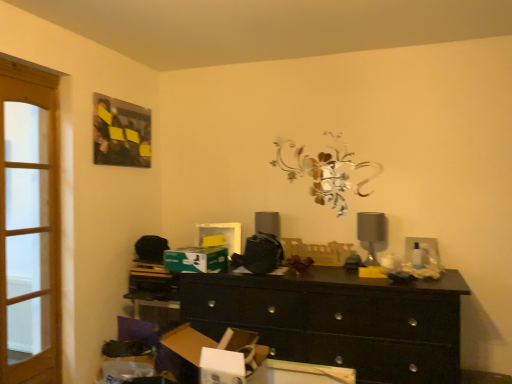
Find the location of a particular element. This screenshot has height=384, width=512. free space in front of yellow plastic tray at center is located at coordinates (319, 265).